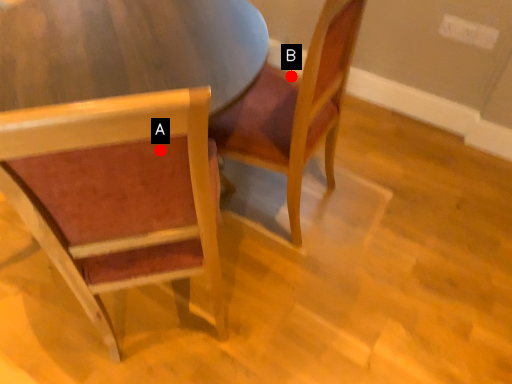
Question: Two points are circled on the image, labeled by A and B beside each circle. Which point is farther to the camera?

Choices:
 (A) A is further
 (B) B is further

Answer: (B)